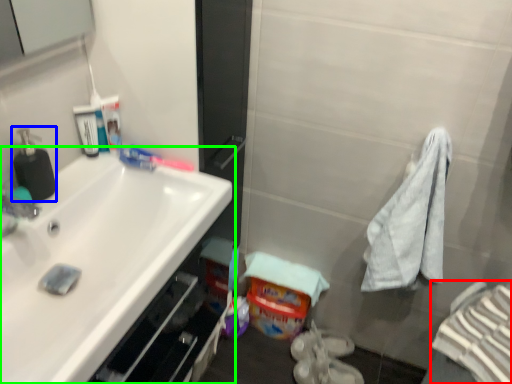
Question: Which object is positioned closest to bath towel (highlighted by a red box)? Select from soap dispenser (highlighted by a blue box) and sink (highlighted by a green box).

Choices:
 (A) soap dispenser
 (B) sink

Answer: (B)